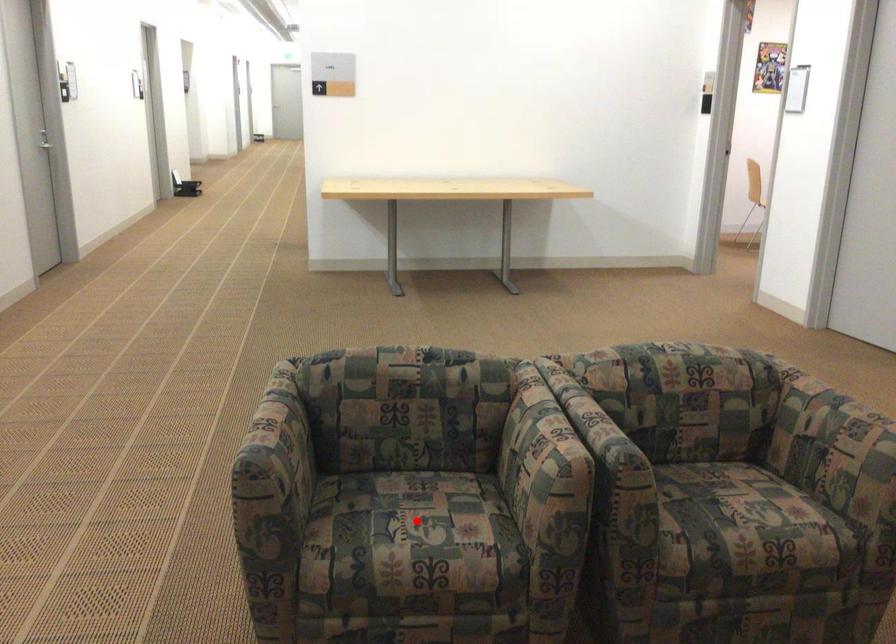
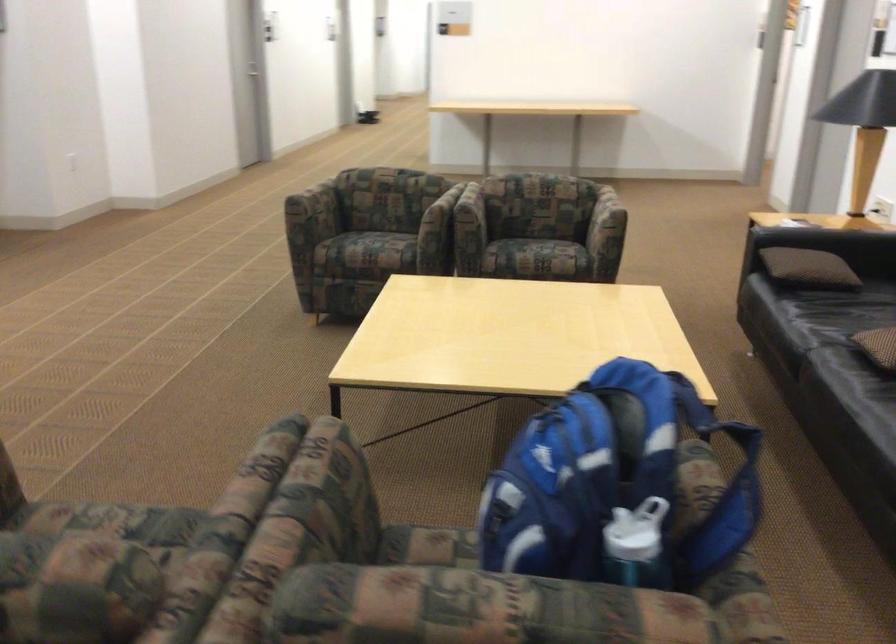
Question: I am providing you with two images of the same scene from different viewpoints. A red point is marked on the first image. Is the red point's position out of view in image 2?

Choices:
 (A) Yes
 (B) No

Answer: (A)